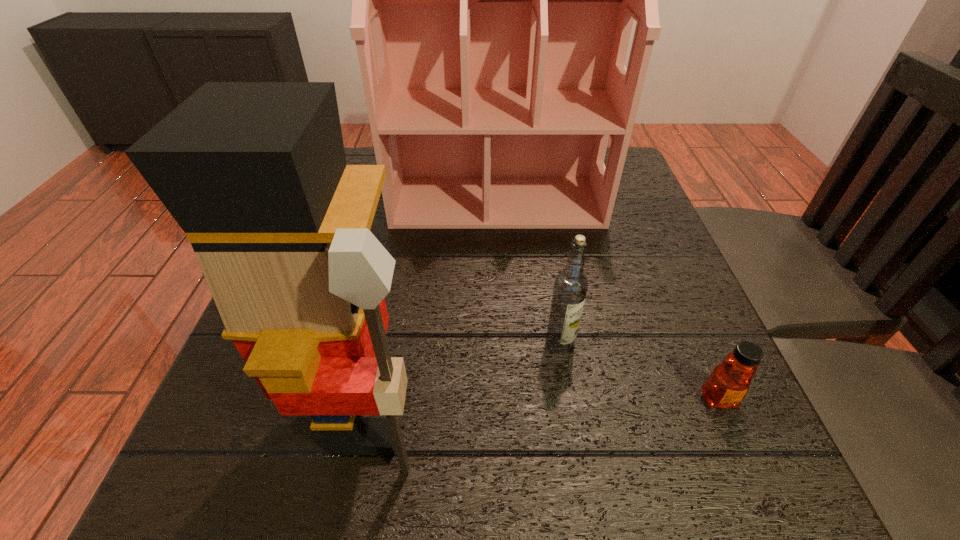
Locate an element on the screen. the farthest object is located at coordinates (493, 0).

The width and height of the screenshot is (960, 540). I want to click on nutcracker, so click(255, 174).

You are a GUI agent. You are given a task and a screenshot of the screen. Output one action in this format:
    pyautogui.click(x=<x>, y=<y>)
    Task: Click on the second shortest object
    The image size is (960, 540).
    Given the screenshot: What is the action you would take?
    pyautogui.click(x=570, y=288)

Where is `the shortest object`? The width and height of the screenshot is (960, 540). the shortest object is located at coordinates (727, 385).

Locate an element on the screen. Image resolution: width=960 pixels, height=540 pixels. honey is located at coordinates (727, 385).

What are the coordinates of `vacant region located on the front-facing side of the farthest object` in the screenshot? It's located at (502, 300).

In order to click on vacant space situated 0.120m in front of the nutcracker holding the staff in this screenshot , I will do `click(517, 415)`.

Find the location of a particular element. vacant space located on the label of the vodka is located at coordinates pyautogui.click(x=584, y=491).

At what (x,y) coordinates should I click in order to perform the action: click on vacant space located 0.110m on the front label of the rightmost object. Please return your answer as a coordinate pair (x, y). This screenshot has height=540, width=960. Looking at the image, I should click on (760, 495).

This screenshot has height=540, width=960. What are the coordinates of `object that is at the far edge` in the screenshot? It's located at (493, 0).